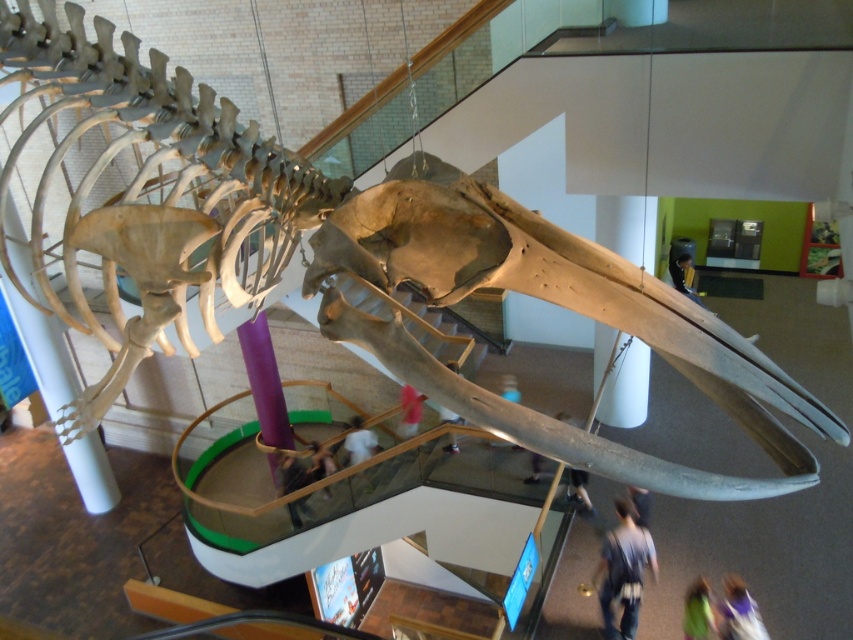
You are standing at the base of the whale skeleton exhibit in the museum. You notice two points marked on the floor at coordinates point (720,628) and point (450,444). If you were to walk towards the entrance of the museum, which point would you encounter first?

Point (720,628) is in front of point (450,444), so you would encounter point (720,628) first as you walk towards the entrance.

You are a visitor standing at the glass railing looking up at the whale skeleton. You notice the pink fabric at lower center and the smooth brown hair at center. Which object is closer to you?

The pink fabric at lower center is closer to you because it is in front of the smooth brown hair at center.